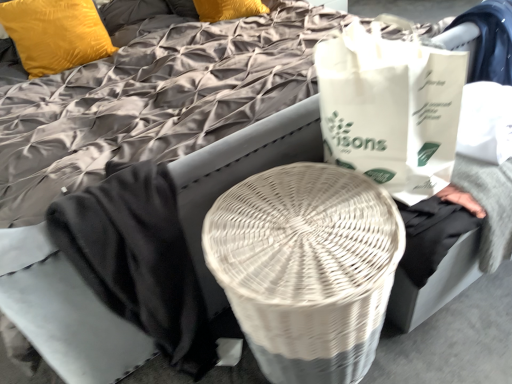
Question: Can you confirm if white wicker basket at center is bigger than white paper grocery bag at right?

Choices:
 (A) yes
 (B) no

Answer: (A)

Question: Is white wicker basket at center not inside white paper grocery bag at right?

Choices:
 (A) yes
 (B) no

Answer: (A)

Question: Is white wicker basket at center taller than white paper grocery bag at right?

Choices:
 (A) yes
 (B) no

Answer: (A)

Question: Can you confirm if white wicker basket at center is positioned to the right of white paper grocery bag at right?

Choices:
 (A) no
 (B) yes

Answer: (A)

Question: Is white wicker basket at center not near white paper grocery bag at right?

Choices:
 (A) yes
 (B) no

Answer: (B)

Question: Is velvet yellow pillow at upper left spatially inside white paper grocery bag at right, or outside of it?

Choices:
 (A) outside
 (B) inside

Answer: (A)

Question: Is velvet yellow pillow at upper left in front of or behind white paper grocery bag at right in the image?

Choices:
 (A) front
 (B) behind

Answer: (B)

Question: In terms of size, does velvet yellow pillow at upper left appear bigger or smaller than white paper grocery bag at right?

Choices:
 (A) big
 (B) small

Answer: (A)

Question: Is velvet yellow pillow at upper left taller or shorter than white paper grocery bag at right?

Choices:
 (A) tall
 (B) short

Answer: (B)

Question: Is velvet yellow pillow at upper left inside the boundaries of white wicker basket at center, or outside?

Choices:
 (A) outside
 (B) inside

Answer: (A)

Question: Looking at the image, does velvet yellow pillow at upper left seem bigger or smaller compared to white wicker basket at center?

Choices:
 (A) small
 (B) big

Answer: (A)

Question: Relative to white wicker basket at center, is velvet yellow pillow at upper left in front or behind?

Choices:
 (A) front
 (B) behind

Answer: (B)

Question: From the image's perspective, is velvet yellow pillow at upper left above or below white wicker basket at center?

Choices:
 (A) below
 (B) above

Answer: (B)

Question: From the image's perspective, is white paper grocery bag at right positioned above or below velvet yellow pillow at upper left?

Choices:
 (A) above
 (B) below

Answer: (B)

Question: Considering the relative positions of white paper grocery bag at right and velvet yellow pillow at upper left in the image provided, is white paper grocery bag at right to the left or to the right of velvet yellow pillow at upper left?

Choices:
 (A) left
 (B) right

Answer: (B)